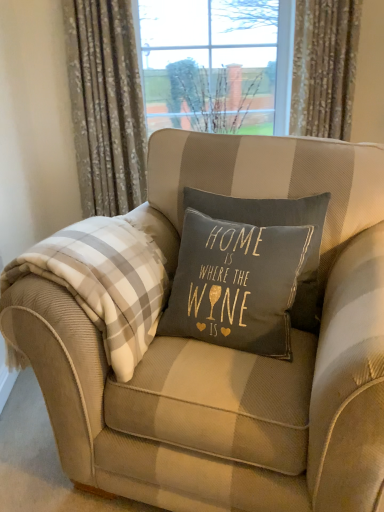
This screenshot has width=384, height=512. Find the location of `floral fabric curtain at upper right, which is the 2th curtain from left to right`. floral fabric curtain at upper right, which is the 2th curtain from left to right is located at coordinates (324, 67).

Where is `white plaid blanket at left`? The image size is (384, 512). white plaid blanket at left is located at coordinates tap(106, 281).

Is floral fabric curtain at upper left, marked as the 2th curtain in a right-to-left arrangement, thinner than beige striped armchair at center?

Correct, the width of floral fabric curtain at upper left, marked as the 2th curtain in a right-to-left arrangement, is less than that of beige striped armchair at center.

Choose the correct answer: Is floral fabric curtain at upper left, marked as the 2th curtain in a right-to-left arrangement, inside beige striped armchair at center or outside it?

floral fabric curtain at upper left, marked as the 2th curtain in a right-to-left arrangement, cannot be found inside beige striped armchair at center.

Is floral fabric curtain at upper left, marked as the 2th curtain in a right-to-left arrangement, turned away from beige striped armchair at center?

That's not correct — floral fabric curtain at upper left, marked as the 2th curtain in a right-to-left arrangement, is not looking away from beige striped armchair at center.

What's the angular difference between floral fabric curtain at upper left, marked as the 2th curtain in a right-to-left arrangement, and beige striped armchair at center's facing directions?

They differ by 23 degrees in their facing directions.

Consider the image. From the image's perspective, is floral fabric curtain at upper right, which ranks as the first curtain in right-to-left order, located above beige striped armchair at center?

Correct, floral fabric curtain at upper right, which ranks as the first curtain in right-to-left order, appears higher than beige striped armchair at center in the image.

Does floral fabric curtain at upper right, which ranks as the first curtain in right-to-left order, appear on the right side of beige striped armchair at center?

Yes, floral fabric curtain at upper right, which ranks as the first curtain in right-to-left order, is to the right of beige striped armchair at center.

Is floral fabric curtain at upper right, which ranks as the first curtain in right-to-left order, oriented towards beige striped armchair at center?

No.

In terms of width, does floral fabric curtain at upper right, which ranks as the first curtain in right-to-left order, look wider or thinner when compared to beige striped armchair at center?

Clearly, floral fabric curtain at upper right, which ranks as the first curtain in right-to-left order, has less width compared to beige striped armchair at center.

Choose the correct answer: Is white plaid blanket at left inside floral fabric curtain at upper left, marked as the 2th curtain in a right-to-left arrangement, or outside it?

white plaid blanket at left lies outside floral fabric curtain at upper left, marked as the 2th curtain in a right-to-left arrangement.

Can you confirm if white plaid blanket at left is positioned to the left of floral fabric curtain at upper left, marked as the 2th curtain in a right-to-left arrangement?

In fact, white plaid blanket at left is to the right of floral fabric curtain at upper left, marked as the 2th curtain in a right-to-left arrangement.

Considering the positions of points (124, 362) and (88, 178), is point (124, 362) closer to camera compared to point (88, 178)?

Yes, point (124, 362) is in front of point (88, 178).

Which object is further away from the camera, white plaid blanket at left or floral fabric curtain at upper left, the 1th curtain positioned from the left?

floral fabric curtain at upper left, the 1th curtain positioned from the left, is more distant.

Is beige striped armchair at center positioned behind floral fabric curtain at upper left, marked as the 2th curtain in a right-to-left arrangement?

That is False.

From a real-world perspective, who is located higher, beige striped armchair at center or floral fabric curtain at upper left, marked as the 2th curtain in a right-to-left arrangement?

floral fabric curtain at upper left, marked as the 2th curtain in a right-to-left arrangement, is physically above.

Considering the relative sizes of beige striped armchair at center and floral fabric curtain at upper left, the 1th curtain positioned from the left, in the image provided, is beige striped armchair at center thinner than floral fabric curtain at upper left, the 1th curtain positioned from the left,?

No.

Is beige striped armchair at center not close to floral fabric curtain at upper left, the 1th curtain positioned from the left?

Yes.

Between white plaid blanket at left and beige striped armchair at center, which one has less height?

With less height is white plaid blanket at left.

Is point (69, 281) positioned before point (247, 477)?

No, it is not.

From the image's perspective, which one is positioned lower, white plaid blanket at left or beige striped armchair at center?

From the image's view, beige striped armchair at center is below.

From a real-world perspective, is white plaid blanket at left located beneath beige striped armchair at center?

Actually, white plaid blanket at left is physically above beige striped armchair at center in the real world.

Find the location of a particular element. curtain located on the left of floral fabric curtain at upper right, which is the 2th curtain from left to right is located at coordinates (106, 105).

Is floral fabric curtain at upper right, which is the 2th curtain from left to right, smaller than floral fabric curtain at upper left, marked as the 2th curtain in a right-to-left arrangement?

Indeed, floral fabric curtain at upper right, which is the 2th curtain from left to right, has a smaller size compared to floral fabric curtain at upper left, marked as the 2th curtain in a right-to-left arrangement.

From a real-world perspective, between white plaid blanket at left and floral fabric curtain at upper right, which ranks as the first curtain in right-to-left order, who is vertically higher?

floral fabric curtain at upper right, which ranks as the first curtain in right-to-left order.

Is white plaid blanket at left oriented away from floral fabric curtain at upper right, which ranks as the first curtain in right-to-left order?

Correct, white plaid blanket at left is looking away from floral fabric curtain at upper right, which ranks as the first curtain in right-to-left order.

At what (x,y) coordinates should I click in order to perform the action: click on chair located on the right of floral fabric curtain at upper left, marked as the 2th curtain in a right-to-left arrangement. Please return your answer as a coordinate pair (x, y). Looking at the image, I should click on click(230, 353).

Locate an element on the screen. The width and height of the screenshot is (384, 512). chair below the floral fabric curtain at upper right, which is the 2th curtain from left to right (from the image's perspective) is located at coordinates (230, 353).

When comparing their distances from floral fabric curtain at upper left, marked as the 2th curtain in a right-to-left arrangement, does beige striped armchair at center or white plaid blanket at left seem further?

white plaid blanket at left.

Considering their positions, is white plaid blanket at left positioned further to beige striped armchair at center than floral fabric curtain at upper left, the 1th curtain positioned from the left?

floral fabric curtain at upper left, the 1th curtain positioned from the left, lies further to beige striped armchair at center than the other object.

Considering their positions, is beige striped armchair at center positioned further to floral fabric curtain at upper right, which is the 2th curtain from left to right, than white plaid blanket at left?

Among the two, white plaid blanket at left is located further to floral fabric curtain at upper right, which is the 2th curtain from left to right.

Consider the image. Considering their positions, is floral fabric curtain at upper right, which is the 2th curtain from left to right, positioned closer to beige striped armchair at center than white plaid blanket at left?

The object closer to beige striped armchair at center is white plaid blanket at left.

Estimate the real-world distances between objects in this image. Which object is further from floral fabric curtain at upper right, which is the 2th curtain from left to right, beige striped armchair at center or floral fabric curtain at upper left, the 1th curtain positioned from the left?

Based on the image, beige striped armchair at center appears to be further to floral fabric curtain at upper right, which is the 2th curtain from left to right.

Looking at the image, which one is located closer to floral fabric curtain at upper left, marked as the 2th curtain in a right-to-left arrangement, white plaid blanket at left or beige striped armchair at center?

The object closer to floral fabric curtain at upper left, marked as the 2th curtain in a right-to-left arrangement, is beige striped armchair at center.

Based on their spatial positions, is floral fabric curtain at upper right, which is the 2th curtain from left to right, or beige striped armchair at center closer to white plaid blanket at left?

Based on the image, beige striped armchair at center appears to be nearer to white plaid blanket at left.

Looking at this image, looking at the image, which one is located further to floral fabric curtain at upper right, which ranks as the first curtain in right-to-left order, floral fabric curtain at upper left, the 1th curtain positioned from the left, or white plaid blanket at left?

white plaid blanket at left is further to floral fabric curtain at upper right, which ranks as the first curtain in right-to-left order.

In order to click on curtain positioned between beige striped armchair at center and floral fabric curtain at upper right, which is the 2th curtain from left to right, from near to far in this screenshot , I will do `click(106, 105)`.

Where is `flannel situated between floral fabric curtain at upper left, the 1th curtain positioned from the left, and floral fabric curtain at upper right, which is the 2th curtain from left to right, from left to right`? This screenshot has width=384, height=512. flannel situated between floral fabric curtain at upper left, the 1th curtain positioned from the left, and floral fabric curtain at upper right, which is the 2th curtain from left to right, from left to right is located at coordinates (106, 281).

This screenshot has height=512, width=384. In order to click on flannel located between beige striped armchair at center and floral fabric curtain at upper left, the 1th curtain positioned from the left, in the depth direction in this screenshot , I will do `click(106, 281)`.

The width and height of the screenshot is (384, 512). Identify the location of flannel between beige striped armchair at center and floral fabric curtain at upper right, which ranks as the first curtain in right-to-left order, from front to back. tap(106, 281).